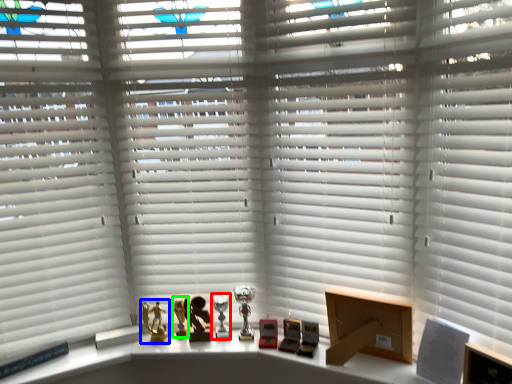
Question: Based on their relative distances, which object is farther from table lamp (highlighted by a red box)? Choose from toy (highlighted by a blue box) and miniature (highlighted by a green box).

Choices:
 (A) toy
 (B) miniature

Answer: (A)